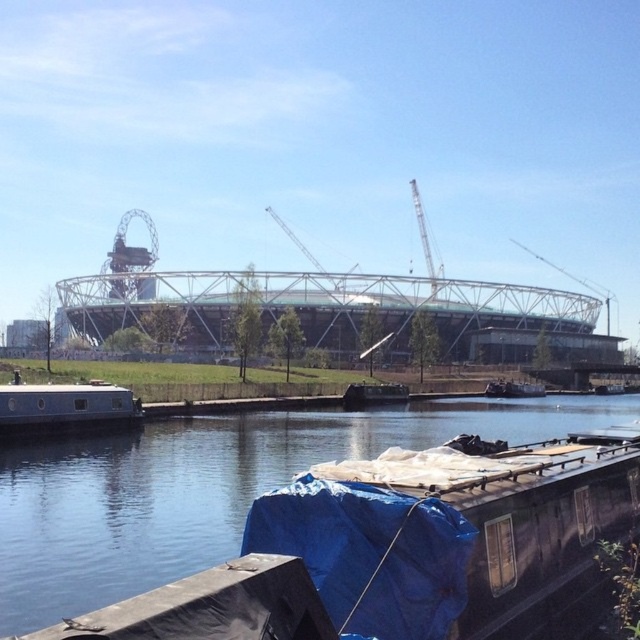
From the picture: Who is shorter, blue tarp-covered boat at lower right or white matte boat at lower left?

Standing shorter between the two is blue tarp-covered boat at lower right.

Does blue tarp-covered boat at lower right have a smaller size compared to white matte boat at lower left?

Incorrect, blue tarp-covered boat at lower right is not smaller in size than white matte boat at lower left.

The image size is (640, 640). What are the coordinates of `blue tarp-covered boat at lower right` in the screenshot? It's located at (202, 490).